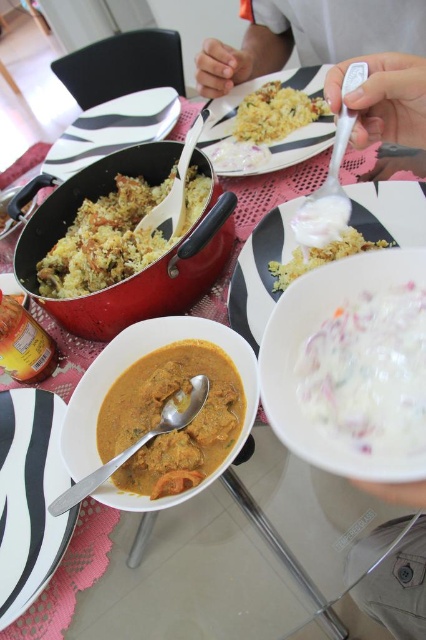
Question: Which object appears farthest from the camera in this image?

Choices:
 (A) white creamy salad at center
 (B) black glossy plate at center
 (C) matte white plate at center
 (D) yellow matte curry at center

Answer: (C)

Question: Among these points, which one is nearest to the camera?

Choices:
 (A) (250, 257)
 (B) (357, 442)
 (C) (397, 26)

Answer: (B)

Question: Can you confirm if white matte plate at center is thinner than matte white plate at center?

Choices:
 (A) yes
 (B) no

Answer: (B)

Question: From the image, what is the correct spatial relationship of yellow rice at center in relation to yellowish rice at center?

Choices:
 (A) below
 (B) above

Answer: (B)

Question: Considering the real-world distances, which object is closest to the white creamy salad at center?

Choices:
 (A) matte red pot at center
 (B) white plastic spoon at upper center
 (C) yellowish rice at center
 (D) matte white plate at center

Answer: (C)

Question: Can you confirm if matte red pot at center is thinner than yellow rice at center?

Choices:
 (A) yes
 (B) no

Answer: (B)